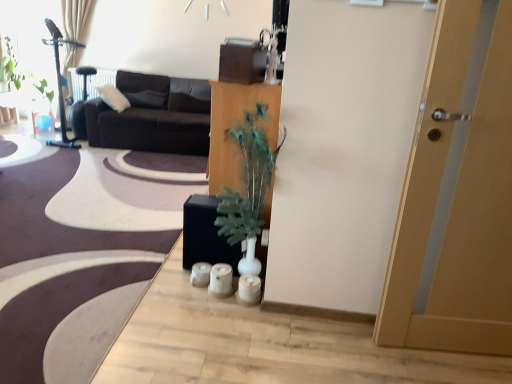
You are a GUI agent. You are given a task and a screenshot of the screen. Output one action in this format:
    pyautogui.click(x=<x>, y=<y>)
    Task: Click on the green leafy plant at upper left
    
    Given the screenshot: What is the action you would take?
    tap(12, 72)

The width and height of the screenshot is (512, 384). What do you see at coordinates (457, 201) in the screenshot? I see `light brown wood door at right` at bounding box center [457, 201].

This screenshot has height=384, width=512. Identify the location of light brown wood door at right. (457, 201).

Consider the image. What is the approximate height of transparent glass window screen at upper left?

The height of transparent glass window screen at upper left is 5.21 feet.

Describe the element at coordinates (113, 97) in the screenshot. This screenshot has height=384, width=512. I see `white soft pillow at upper left` at that location.

The width and height of the screenshot is (512, 384). I want to click on black matte speaker at lower left, so click(79, 250).

Identify the location of green leafy plant at upper left. (12, 72).

How distant is light brown wood door at right from transparent glass window screen at upper left?

light brown wood door at right is 16.51 feet from transparent glass window screen at upper left.

Which is correct: light brown wood door at right is inside transparent glass window screen at upper left, or outside of it?

light brown wood door at right is not enclosed by transparent glass window screen at upper left.

Who is taller, light brown wood door at right or transparent glass window screen at upper left?

transparent glass window screen at upper left is taller.

Which object is more forward, light brown wood door at right or transparent glass window screen at upper left?

light brown wood door at right is closer to the camera.

Could you tell me if green leafy plant at upper left is facing light brown wood door at right?

No, green leafy plant at upper left does not turn towards light brown wood door at right.

What's the angular difference between green leafy plant at upper left and light brown wood door at right's facing directions?

0.751 degrees separate the facing orientations of green leafy plant at upper left and light brown wood door at right.

Which object is positioned more to the left, green leafy plant at upper left or light brown wood door at right?

green leafy plant at upper left is more to the left.

From the picture: From the image's perspective, is green leafy plant at upper left above light brown wood door at right?

Correct, green leafy plant at upper left appears higher than light brown wood door at right in the image.

Is green leafy plant at upper left far from wooden cabinet at center?

green leafy plant at upper left is far away from wooden cabinet at center.

In the scene shown: Choose the correct answer: Is green leafy plant at upper left inside wooden cabinet at center or outside it?

green leafy plant at upper left is not enclosed by wooden cabinet at center.

Between green leafy plant at upper left and wooden cabinet at center, which one appears on the right side from the viewer's perspective?

Positioned to the right is wooden cabinet at center.

Would you say white soft pillow at upper left is inside or outside transparent glass window screen at upper left?

The correct answer is: outside.

Is white soft pillow at upper left smaller than transparent glass window screen at upper left?

No, white soft pillow at upper left is not smaller than transparent glass window screen at upper left.

Does white soft pillow at upper left have a greater height compared to transparent glass window screen at upper left?

No.

Is transparent glass window screen at upper left bigger or smaller than green leafy plant at upper left?

transparent glass window screen at upper left is bigger than green leafy plant at upper left.

From the image's perspective, which is below, transparent glass window screen at upper left or green leafy plant at upper left?

green leafy plant at upper left is shown below in the image.

Is transparent glass window screen at upper left at the right side of green leafy plant at upper left?

Correct, you'll find transparent glass window screen at upper left to the right of green leafy plant at upper left.

Is wooden cabinet at center oriented away from green leafy plant at upper left?

That's not correct — wooden cabinet at center is not looking away from green leafy plant at upper left.

Is point (275, 88) closer or farther from the camera than point (19, 74)?

Point (275, 88) is closer to the camera than point (19, 74).

In the image, there is a wooden cabinet at center. At what (x,y) coordinates should I click in order to perform the action: click on plant above it (from the image's perspective). Please return your answer as a coordinate pair (x, y). The image size is (512, 384). Looking at the image, I should click on (12, 72).

Is wooden cabinet at center touching green leafy plant at upper left?

wooden cabinet at center and green leafy plant at upper left are clearly separated.

You are a GUI agent. You are given a task and a screenshot of the screen. Output one action in this format:
    pyautogui.click(x=<x>, y=<y>)
    Task: Click on the studio couch that appears in front of the green leafy plant at upper left
    The height and width of the screenshot is (384, 512).
    Given the screenshot: What is the action you would take?
    pyautogui.click(x=153, y=116)

Is green leafy plant at upper left with dark brown fabric couch at upper left?

They are not placed beside each other.

Considering the sizes of objects green leafy plant at upper left and dark brown fabric couch at upper left in the image provided, who is wider, green leafy plant at upper left or dark brown fabric couch at upper left?

With larger width is dark brown fabric couch at upper left.

Measure the distance between green leafy plant at upper left and dark brown fabric couch at upper left.

green leafy plant at upper left and dark brown fabric couch at upper left are 1.73 meters apart from each other.

At what (x,y) coordinates should I click in order to perform the action: click on door on the right of transparent glass window screen at upper left. Please return your answer as a coordinate pair (x, y). The image size is (512, 384). Looking at the image, I should click on (457, 201).

Locate an element on the screen. This screenshot has height=384, width=512. door below the green leafy plant at upper left (from a real-world perspective) is located at coordinates (457, 201).

When comparing their distances from dark brown fabric couch at upper left, does white soft pillow at upper left or wooden cabinet at center seem further?

The object further to dark brown fabric couch at upper left is wooden cabinet at center.

Estimate the real-world distances between objects in this image. Which object is further from green leafy plant at upper left, light brown wood door at right or black matte speaker at lower left?

Based on the image, light brown wood door at right appears to be further to green leafy plant at upper left.

From the image, which object appears to be farther from dark brown fabric couch at upper left, wooden cabinet at center or white soft pillow at upper left?

The object further to dark brown fabric couch at upper left is wooden cabinet at center.

When comparing their distances from white soft pillow at upper left, does black matte speaker at lower left or light brown wood door at right seem further?

light brown wood door at right is positioned further to the anchor white soft pillow at upper left.

Looking at the image, which one is located further to dark brown fabric couch at upper left, green leafy plant at upper left or light brown wood door at right?

light brown wood door at right is further to dark brown fabric couch at upper left.

Which object lies further to the anchor point white soft pillow at upper left, transparent glass window screen at upper left or light brown wood door at right?

light brown wood door at right is positioned further to the anchor white soft pillow at upper left.

Considering their positions, is dark brown fabric couch at upper left positioned closer to wooden cabinet at center than green leafy plant at upper left?

Based on the image, dark brown fabric couch at upper left appears to be nearer to wooden cabinet at center.

Consider the image. Which object lies further to the anchor point wooden cabinet at center, green leafy plant at upper left or dark brown fabric couch at upper left?

Among the two, green leafy plant at upper left is located further to wooden cabinet at center.

The width and height of the screenshot is (512, 384). I want to click on pillow positioned between light brown wood door at right and transparent glass window screen at upper left from near to far, so click(113, 97).

I want to click on studio couch positioned between black matte speaker at lower left and transparent glass window screen at upper left from near to far, so click(153, 116).

Locate an element on the screen. This screenshot has height=384, width=512. window screen between green leafy plant at upper left and white soft pillow at upper left is located at coordinates (32, 38).

You are a GUI agent. You are given a task and a screenshot of the screen. Output one action in this format:
    pyautogui.click(x=<x>, y=<y>)
    Task: Click on the studio couch between wooden cabinet at center and white soft pillow at upper left from front to back
    This screenshot has height=384, width=512.
    Given the screenshot: What is the action you would take?
    pyautogui.click(x=153, y=116)